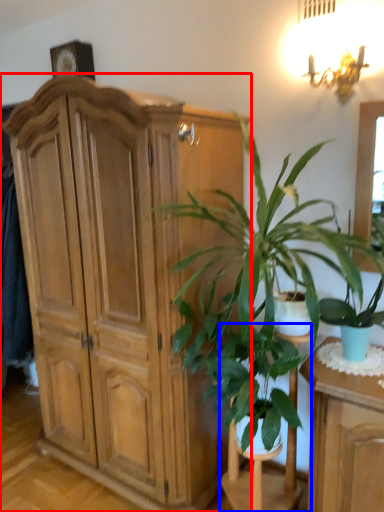
Question: Which object is further to the camera taking this photo, cabinetry (highlighted by a red box) or armchair (highlighted by a blue box)?

Choices:
 (A) cabinetry
 (B) armchair

Answer: (A)